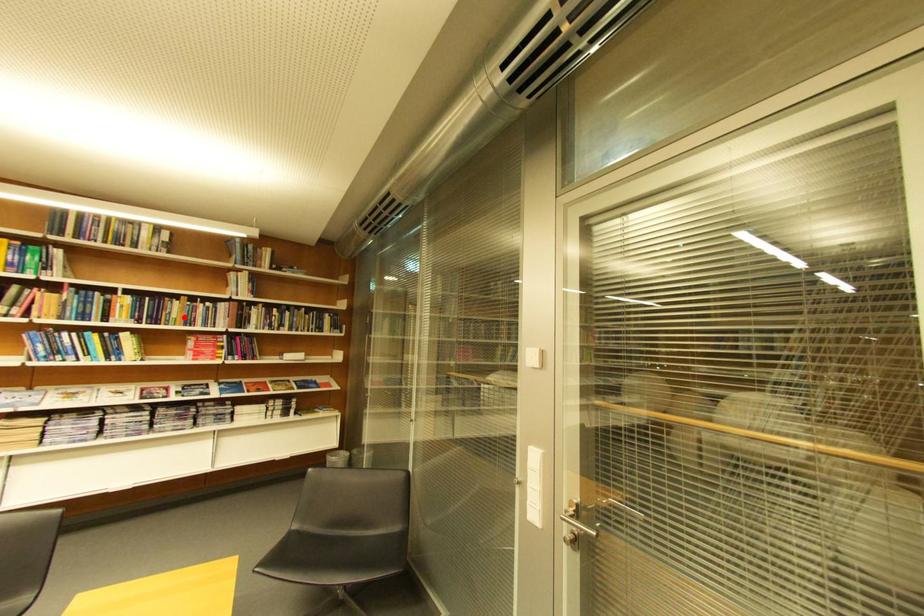
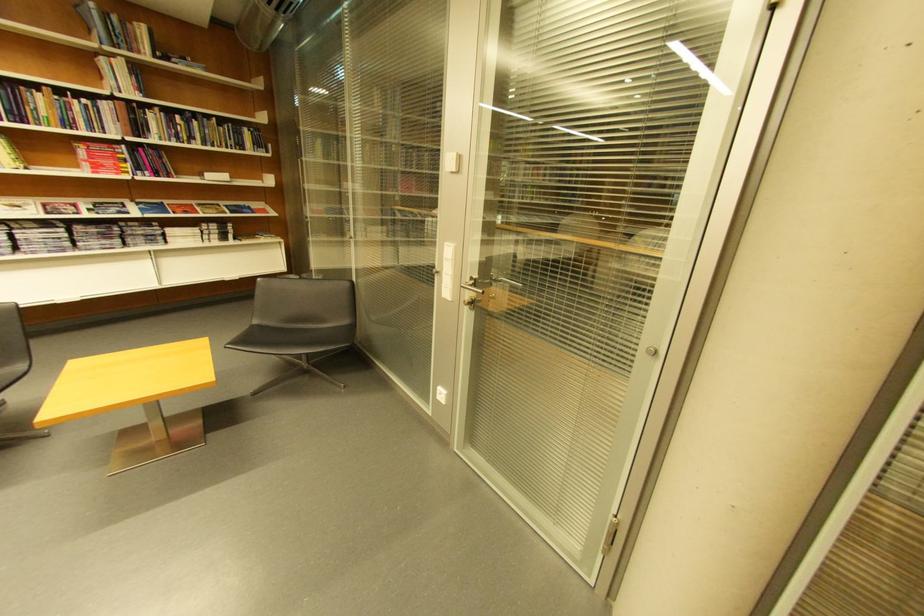
Question: I am providing you with two images of the same scene from different viewpoints. Given a red point in image1, look at the same physical point in image2. Is it:

Choices:
 (A) Closer to the viewpoint
 (B) Farther from the viewpoint

Answer: (B)